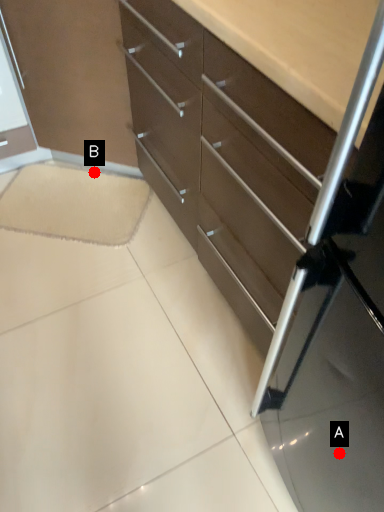
Question: Two points are circled on the image, labeled by A and B beside each circle. Which point is closer to the camera?

Choices:
 (A) A is closer
 (B) B is closer

Answer: (A)